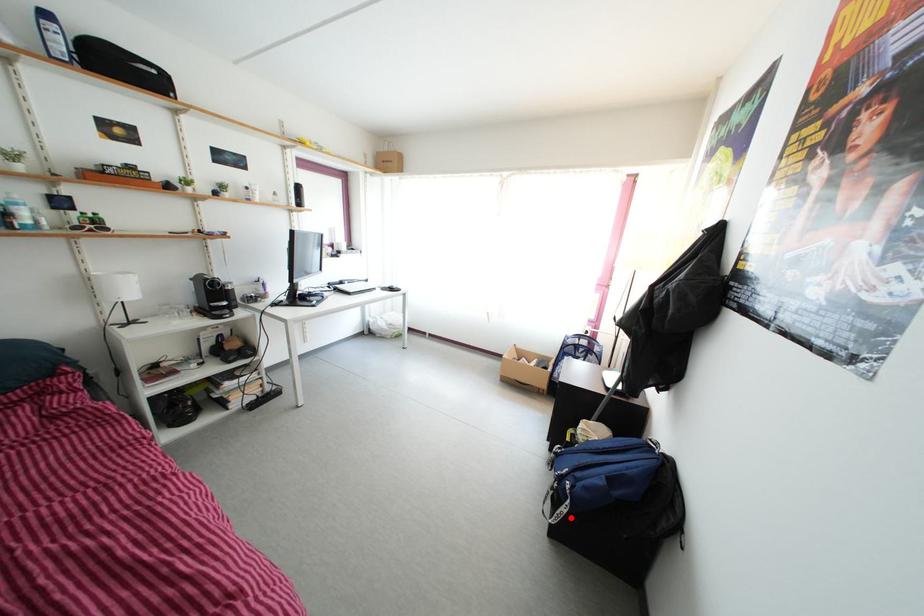
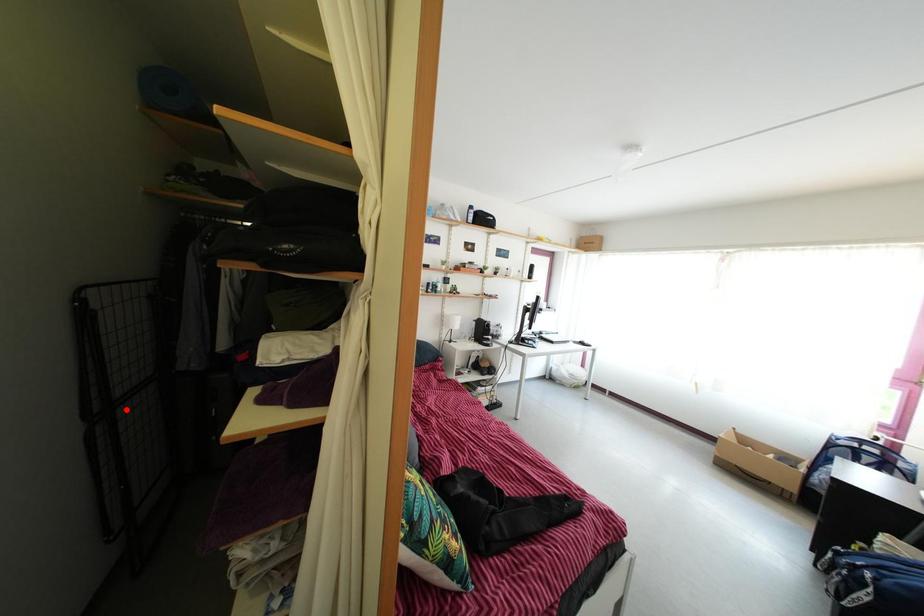
I am providing you with two images of the same scene from different viewpoints. A red point is marked on the first image and another point is marked on the second image. Is the red point in image1 aligned with the point shown in image2?

No